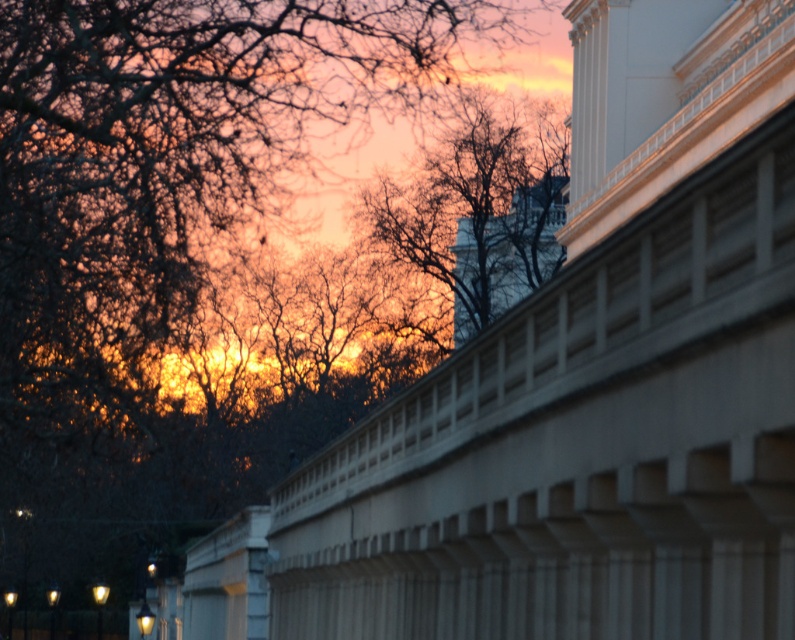
Based on the photo, you are standing in front of the classical building and want to take a photo of the sunset. Which tree, the brown leafless tree at upper left or the brown textured tree at center, is closer to the building?

The brown leafless tree at upper left is closer to the building because it is positioned under the brown textured tree at center, indicating it is in front of the latter.

Based on the coordinates provided, where is the brown leafless tree at upper left located in the image?

The brown leafless tree at upper left is located at point (200, 260).